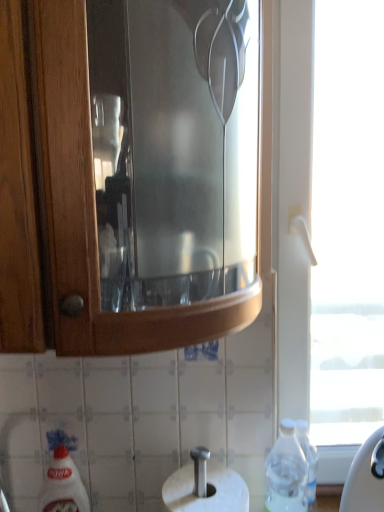
Identify the location of white glossy bottle at lower left. Image resolution: width=384 pixels, height=512 pixels. (63, 485).

What is the approximate width of white glossy bottle at lower left?

The width of white glossy bottle at lower left is 2.54 inches.

Where is `white glossy bottle at lower left`? white glossy bottle at lower left is located at coordinates (63, 485).

Considering the positions of point (266, 499) and point (72, 471), is point (266, 499) closer or farther from the camera than point (72, 471)?

Point (266, 499) is positioned closer to the camera compared to point (72, 471).

From the picture: Does transparent plastic bottle at lower right appear on the left side of white glossy bottle at lower left?

In fact, transparent plastic bottle at lower right is to the right of white glossy bottle at lower left.

Considering the sizes of objects transparent plastic bottle at lower right and white glossy bottle at lower left in the image provided, who is bigger, transparent plastic bottle at lower right or white glossy bottle at lower left?

transparent plastic bottle at lower right.

Who is bigger, transparent glass window at right or transparent plastic bottle at lower right?

Bigger between the two is transparent glass window at right.

In the image, is transparent glass window at right positioned in front of or behind transparent plastic bottle at lower right?

Clearly, transparent glass window at right is behind transparent plastic bottle at lower right.

Is transparent glass window at right next to transparent plastic bottle at lower right and touching it?

No, transparent glass window at right is not beside transparent plastic bottle at lower right.

Do you think transparent plastic bottle at lower right is within transparent glass window at right, or outside of it?

transparent plastic bottle at lower right is outside transparent glass window at right.

How many degrees apart are the facing directions of transparent plastic bottle at lower right and transparent glass window at right?

The angular difference between transparent plastic bottle at lower right and transparent glass window at right is 0.236 degrees.

Looking at the image, does transparent plastic bottle at lower right seem bigger or smaller compared to transparent glass window at right?

In the image, transparent plastic bottle at lower right appears to be smaller than transparent glass window at right.

Is transparent plastic bottle at lower right beside transparent glass window at right?

No, transparent plastic bottle at lower right is not beside transparent glass window at right.

The height and width of the screenshot is (512, 384). I want to click on bottle in front of the white glossy bottle at lower left, so click(286, 473).

Is transparent plastic bottle at lower right at the back of white glossy bottle at lower left?

No.

Is point (86, 493) closer to viewer compared to point (277, 487)?

That is False.

Is white glossy bottle at lower left wider than transparent plastic bottle at lower right?

Incorrect, the width of white glossy bottle at lower left does not surpass that of transparent plastic bottle at lower right.

Could you tell me if white glossy bottle at lower left is facing transparent glass window at right?

No, white glossy bottle at lower left is not facing towards transparent glass window at right.

Considering the relative sizes of white glossy bottle at lower left and transparent glass window at right in the image provided, is white glossy bottle at lower left taller than transparent glass window at right?

In fact, white glossy bottle at lower left may be shorter than transparent glass window at right.

Is white glossy bottle at lower left situated inside transparent glass window at right or outside?

white glossy bottle at lower left is not inside transparent glass window at right, it's outside.

Is white glossy bottle at lower left wider or thinner than transparent glass window at right?

white glossy bottle at lower left is thinner than transparent glass window at right.

Is transparent glass window at right to the left of white glossy bottle at lower left from the viewer's perspective?

In fact, transparent glass window at right is to the right of white glossy bottle at lower left.

Does point (289, 296) appear closer or farther from the camera than point (69, 475)?

Point (289, 296).

Could you tell me if transparent glass window at right is turned towards white glossy bottle at lower left?

No, transparent glass window at right is not facing towards white glossy bottle at lower left.

Find the location of a particular element. This screenshot has height=512, width=384. bottle on the right of the white glossy bottle at lower left is located at coordinates (286, 473).

Identify the location of bottle in front of the transparent glass window at right. (286, 473).

Which object lies further to the anchor point white glossy bottle at lower left, transparent plastic bottle at lower right or transparent glass window at right?

The object further to white glossy bottle at lower left is transparent glass window at right.

Looking at this image, from the image, which object appears to be nearer to transparent glass window at right, transparent plastic bottle at lower right or white glossy bottle at lower left?

Among the two, transparent plastic bottle at lower right is located nearer to transparent glass window at right.

Estimate the real-world distances between objects in this image. Which object is further from transparent plastic bottle at lower right, white glossy bottle at lower left or transparent glass window at right?

transparent glass window at right is further to transparent plastic bottle at lower right.

From the image, which object appears to be nearer to transparent plastic bottle at lower right, transparent glass window at right or white glossy bottle at lower left?

The object closer to transparent plastic bottle at lower right is white glossy bottle at lower left.

From the image, which object appears to be farther from white glossy bottle at lower left, transparent glass window at right or transparent plastic bottle at lower right?

Among the two, transparent glass window at right is located further to white glossy bottle at lower left.

Looking at the image, which one is located closer to transparent glass window at right, white glossy bottle at lower left or transparent plastic bottle at lower right?

transparent plastic bottle at lower right.

In order to click on bottle situated between white glossy bottle at lower left and transparent glass window at right from left to right in this screenshot , I will do `click(286, 473)`.